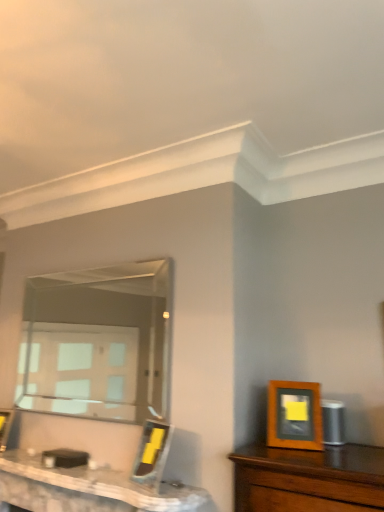
Question: Which direction should I rotate to look at wooden picture frame at center, arranged as the first picture frame when viewed from the back?

Choices:
 (A) right
 (B) left

Answer: (B)

Question: Which direction should I rotate to look at wooden picture frame at center, placed as the second picture frame when sorted from right to left?

Choices:
 (A) left
 (B) right

Answer: (A)

Question: Is white marble table at lower left closer to the viewer compared to wooden picture frame at right, which ranks as the 3th picture frame in left-to-right order?

Choices:
 (A) yes
 (B) no

Answer: (A)

Question: Is white marble table at lower left beside wooden picture frame at right, which is the 3th picture frame from back to front?

Choices:
 (A) no
 (B) yes

Answer: (A)

Question: Does white marble table at lower left have a greater height compared to wooden picture frame at right, arranged as the first picture frame when viewed from the front?

Choices:
 (A) yes
 (B) no

Answer: (B)

Question: From a real-world perspective, is white marble table at lower left located higher than wooden picture frame at right, which is the 3th picture frame from back to front?

Choices:
 (A) no
 (B) yes

Answer: (A)

Question: Is white marble table at lower left at the left side of wooden picture frame at right, which is the first picture frame in right-to-left order?

Choices:
 (A) no
 (B) yes

Answer: (B)

Question: Does white marble table at lower left turn towards wooden picture frame at right, which is the 3th picture frame from back to front?

Choices:
 (A) yes
 (B) no

Answer: (B)

Question: Is wooden picture frame at center, the 2th picture frame from the front, smaller than white marble table at lower left?

Choices:
 (A) no
 (B) yes

Answer: (B)

Question: From the image's perspective, does wooden picture frame at center, the 2th picture frame in the back-to-front sequence, appear higher than white marble table at lower left?

Choices:
 (A) no
 (B) yes

Answer: (B)

Question: Does wooden picture frame at center, the 2th picture frame from the front, have a greater height compared to white marble table at lower left?

Choices:
 (A) yes
 (B) no

Answer: (A)

Question: From a real-world perspective, is wooden picture frame at center, which is counted as the 2th picture frame, starting from the left, positioned under white marble table at lower left based on gravity?

Choices:
 (A) no
 (B) yes

Answer: (A)

Question: Is wooden picture frame at center, the 2th picture frame in the back-to-front sequence, positioned beyond the bounds of white marble table at lower left?

Choices:
 (A) no
 (B) yes

Answer: (B)

Question: Is wooden picture frame at right, which is the first picture frame in right-to-left order, wider than wooden picture frame at center, which is the third picture frame in front-to-back order?

Choices:
 (A) no
 (B) yes

Answer: (A)